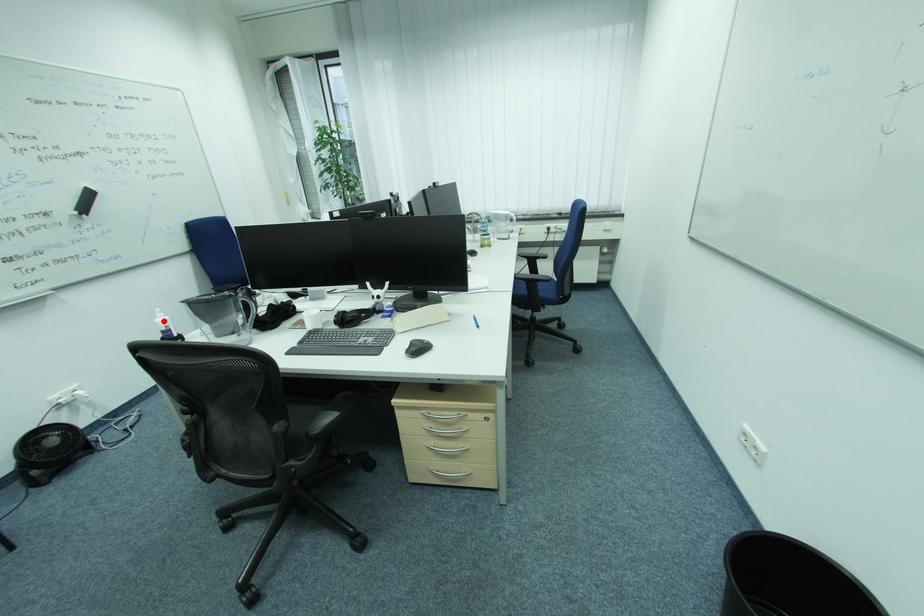
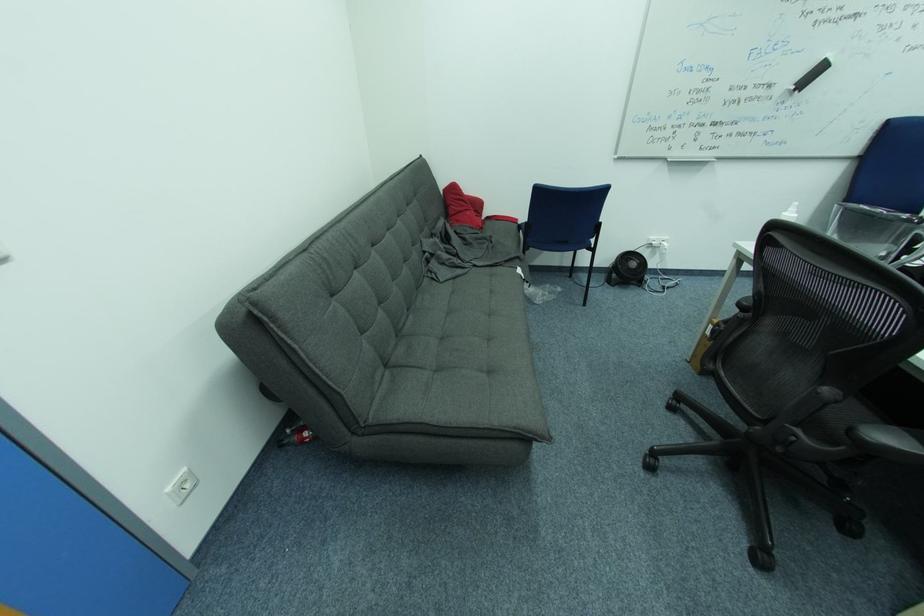
In the second image, find the point that corresponds to the highlighted location in the first image.

(792, 215)